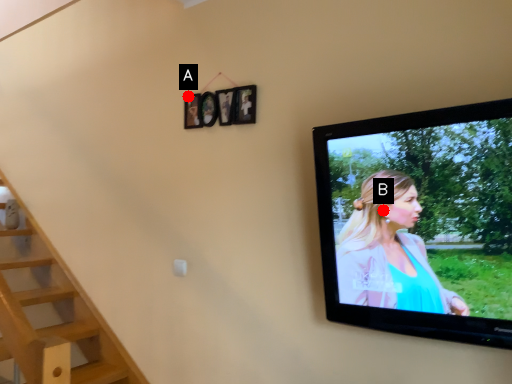
Question: Two points are circled on the image, labeled by A and B beside each circle. Which of the following is the farthest from the observer?

Choices:
 (A) A is further
 (B) B is further

Answer: (A)